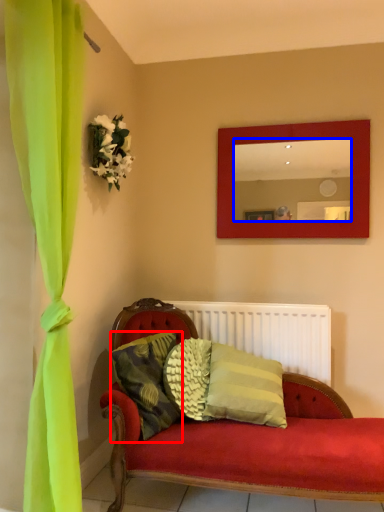
Question: Among these objects, which one is farthest to the camera, pillow (highlighted by a red box) or mirror (highlighted by a blue box)?

Choices:
 (A) pillow
 (B) mirror

Answer: (B)